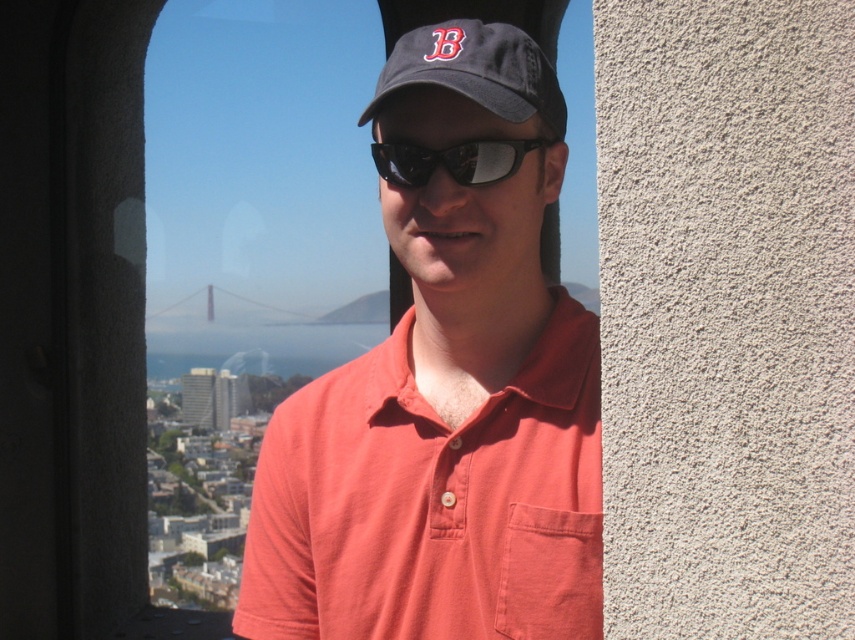
You are standing at the point marked as point (245,592) in the image. You want to take a photo of the Golden Gate Bridge through the window. The camera you have can focus on objects up to 200 meters away. Will the camera be able to capture the bridge clearly?

The point marked as point (245,592) is 200.33 meters away from the viewer. Since the camera can focus up to 200 meters, the distance is slightly beyond its capability. Therefore, the camera may not capture the Golden Gate Bridge clearly.

You are trying to decide which item to pack first for a quick trip. Given the matte orange polo shirt at center and the black reflective sunglasses at center, which one has a greater width?

The matte orange polo shirt at center has a greater width than the black reflective sunglasses at center.

You are an interior designer working on a layout for a room. You have a small decorative item that needs to be placed exactly at the point with coordinates point (445, 396). The room has a matte orange polo shirt at center. Where should you place the decorative item relative to the matte orange polo shirt at center?

The point (445, 396) is on the matte orange polo shirt at center, so you should place the decorative item directly on the matte orange polo shirt at center.